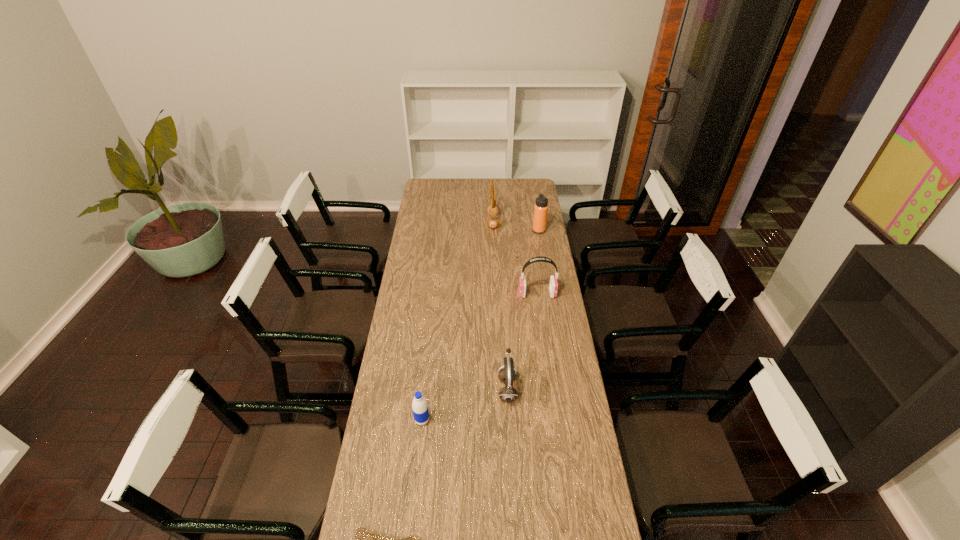
You are a GUI agent. You are given a task and a screenshot of the screen. Output one action in this format:
    pyautogui.click(x=<x>, y=<y>)
    Task: Click on the earphone present at the right edge
    Image resolution: width=960 pixels, height=540 pixels.
    Given the screenshot: What is the action you would take?
    pyautogui.click(x=553, y=285)

The image size is (960, 540). In order to click on free region at the far edge of the desktop in this screenshot , I will do `click(458, 186)`.

Find the location of a particular element. The image size is (960, 540). vacant area at the left edge is located at coordinates (423, 234).

The image size is (960, 540). What are the coordinates of `vacant area at the right edge of the desktop` in the screenshot? It's located at (550, 501).

Locate an element on the screen. Image resolution: width=960 pixels, height=540 pixels. blank space at the far left corner is located at coordinates (440, 192).

You are a GUI agent. You are given a task and a screenshot of the screen. Output one action in this format:
    pyautogui.click(x=<x>, y=<y>)
    Task: Click on the vacant area at the far right corner of the desktop
    
    Given the screenshot: What is the action you would take?
    pyautogui.click(x=533, y=190)

Where is `empty space that is in between the nearest earphone and the fifth farthest object`? This screenshot has width=960, height=540. empty space that is in between the nearest earphone and the fifth farthest object is located at coordinates (465, 404).

At what (x,y) coordinates should I click in order to perform the action: click on vacant area that lies between the nearest earphone and the farthest earphone. Please return your answer as a coordinate pair (x, y). Looking at the image, I should click on (500, 305).

Where is `empty space that is in between the farthest earphone and the third nearest object`? empty space that is in between the farthest earphone and the third nearest object is located at coordinates (500, 305).

At what (x,y) coordinates should I click in order to perform the action: click on free space between the rightmost earphone and the thermos bottle. Please return your answer as a coordinate pair (x, y). The image size is (960, 540). Looking at the image, I should click on (538, 262).